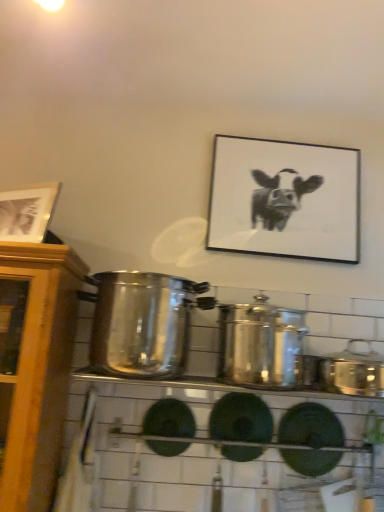
This screenshot has height=512, width=384. Describe the element at coordinates (27, 212) in the screenshot. I see `wooden picture frame at upper left, which is counted as the second picture frame, starting from the back` at that location.

Describe the element at coordinates (284, 199) in the screenshot. The height and width of the screenshot is (512, 384). I see `black matte picture frame at upper center, positioned as the 1th picture frame in right-to-left order` at that location.

Where is `satin silver crock pot at right, the first crock pot in the right-to-left sequence`? satin silver crock pot at right, the first crock pot in the right-to-left sequence is located at coordinates (355, 371).

From a real-world perspective, who is located higher, satin silver pot at center, placed as the first crock pot when sorted from left to right, or shiny metallic crock pot at center, acting as the 2th crock pot starting from the left?

satin silver pot at center, placed as the first crock pot when sorted from left to right.

Is satin silver pot at center, placed as the first crock pot when sorted from left to right, not close to shiny metallic crock pot at center, the second crock pot when ordered from right to left?

satin silver pot at center, placed as the first crock pot when sorted from left to right, is near shiny metallic crock pot at center, the second crock pot when ordered from right to left, not far away.

From the picture: Which is more to the left, satin silver pot at center, which is the third crock pot from right to left, or shiny metallic crock pot at center, the second crock pot when ordered from right to left?

Positioned to the left is satin silver pot at center, which is the third crock pot from right to left.

Can you confirm if satin silver pot at center, which is the third crock pot from right to left, is taller than shiny metallic crock pot at center, the second crock pot when ordered from right to left?

Yes, satin silver pot at center, which is the third crock pot from right to left, is taller than shiny metallic crock pot at center, the second crock pot when ordered from right to left.

Would you say shiny metallic crock pot at center, the second crock pot when ordered from right to left, is inside or outside satin silver pot at center, placed as the first crock pot when sorted from left to right?

shiny metallic crock pot at center, the second crock pot when ordered from right to left, is spatially situated outside satin silver pot at center, placed as the first crock pot when sorted from left to right.

From the image's perspective, does shiny metallic crock pot at center, the second crock pot when ordered from right to left, appear higher than satin silver pot at center, which is the third crock pot from right to left?

No, from the image's perspective, shiny metallic crock pot at center, the second crock pot when ordered from right to left, is not above satin silver pot at center, which is the third crock pot from right to left.

Between shiny metallic crock pot at center, acting as the 2th crock pot starting from the left, and satin silver pot at center, which is the third crock pot from right to left, which one appears on the right side from the viewer's perspective?

From the viewer's perspective, shiny metallic crock pot at center, acting as the 2th crock pot starting from the left, appears more on the right side.

Which of these two, shiny metallic crock pot at center, the second crock pot when ordered from right to left, or satin silver pot at center, placed as the first crock pot when sorted from left to right, stands taller?

satin silver pot at center, placed as the first crock pot when sorted from left to right, is taller.

This screenshot has height=512, width=384. Identify the location of the 2nd crock pot to the right when counting from the satin silver pot at center, placed as the first crock pot when sorted from left to right. (355, 371).

From the image's perspective, which is below, satin silver crock pot at right, the third crock pot in the left-to-right sequence, or satin silver pot at center, placed as the first crock pot when sorted from left to right?

satin silver crock pot at right, the third crock pot in the left-to-right sequence, is shown below in the image.

From the picture: Considering the positions of objects satin silver crock pot at right, the first crock pot in the right-to-left sequence, and satin silver pot at center, placed as the first crock pot when sorted from left to right, in the image provided, who is more to the right, satin silver crock pot at right, the first crock pot in the right-to-left sequence, or satin silver pot at center, placed as the first crock pot when sorted from left to right,?

satin silver crock pot at right, the first crock pot in the right-to-left sequence, is more to the right.

Considering the relative sizes of satin silver crock pot at right, the third crock pot in the left-to-right sequence, and satin silver pot at center, placed as the first crock pot when sorted from left to right, in the image provided, is satin silver crock pot at right, the third crock pot in the left-to-right sequence, smaller than satin silver pot at center, placed as the first crock pot when sorted from left to right,?

Yes, satin silver crock pot at right, the third crock pot in the left-to-right sequence, is smaller than satin silver pot at center, placed as the first crock pot when sorted from left to right.

From a real-world perspective, who is located higher, black matte picture frame at upper center, the second picture frame when ordered from left to right, or satin silver pot at center, which is the third crock pot from right to left?

In real-world perspective, black matte picture frame at upper center, the second picture frame when ordered from left to right, is above.

Between black matte picture frame at upper center, the second picture frame when ordered from left to right, and satin silver pot at center, placed as the first crock pot when sorted from left to right, which one has more height?

black matte picture frame at upper center, the second picture frame when ordered from left to right, is taller.

Considering the positions of point (326, 185) and point (159, 375), is point (326, 185) closer or farther from the camera than point (159, 375)?

Point (326, 185) is farther from the camera than point (159, 375).

Locate an element on the screen. the 2nd crock pot located beneath the wooden picture frame at upper left, the 1th picture frame from the left (from a real-world perspective) is located at coordinates (259, 343).

From a real-world perspective, is shiny metallic crock pot at center, acting as the 2th crock pot starting from the left, above or below wooden picture frame at upper left, the 1th picture frame from the left?

In terms of real-world spatial position, shiny metallic crock pot at center, acting as the 2th crock pot starting from the left, is below wooden picture frame at upper left, the 1th picture frame from the left.

Is shiny metallic crock pot at center, acting as the 2th crock pot starting from the left, oriented towards wooden picture frame at upper left, the second picture frame when ordered from right to left?

No, shiny metallic crock pot at center, acting as the 2th crock pot starting from the left, does not turn towards wooden picture frame at upper left, the second picture frame when ordered from right to left.

Looking at this image, does wooden picture frame at upper left, which is the 1th picture frame in front-to-back order, contain shiny metallic crock pot at center, acting as the 2th crock pot starting from the left?

Actually, shiny metallic crock pot at center, acting as the 2th crock pot starting from the left, is outside wooden picture frame at upper left, which is the 1th picture frame in front-to-back order.

Looking at this image, based on their positions, is wooden picture frame at upper left, the 1th picture frame from the left, located to the left or right of shiny metallic crock pot at center, the second crock pot when ordered from right to left?

In the image, wooden picture frame at upper left, the 1th picture frame from the left, appears on the left side of shiny metallic crock pot at center, the second crock pot when ordered from right to left.

In the image, is wooden picture frame at upper left, which is the 1th picture frame in front-to-back order, positioned in front of or behind shiny metallic crock pot at center, the second crock pot when ordered from right to left?

Visually, wooden picture frame at upper left, which is the 1th picture frame in front-to-back order, is located behind shiny metallic crock pot at center, the second crock pot when ordered from right to left.

Between satin silver crock pot at right, the first crock pot in the right-to-left sequence, and wooden picture frame at upper left, the 1th picture frame from the left, which one has larger size?

With larger size is satin silver crock pot at right, the first crock pot in the right-to-left sequence.

Measure the distance from satin silver crock pot at right, the first crock pot in the right-to-left sequence, to wooden picture frame at upper left, which is counted as the second picture frame, starting from the back.

satin silver crock pot at right, the first crock pot in the right-to-left sequence, and wooden picture frame at upper left, which is counted as the second picture frame, starting from the back, are 37.33 inches apart from each other.

From the image's perspective, is satin silver crock pot at right, the first crock pot in the right-to-left sequence, located above or below wooden picture frame at upper left, which is counted as the second picture frame, starting from the back?

satin silver crock pot at right, the first crock pot in the right-to-left sequence, is below wooden picture frame at upper left, which is counted as the second picture frame, starting from the back.

Locate an element on the screen. crock pot above the shiny metallic crock pot at center, the second crock pot when ordered from right to left (from a real-world perspective) is located at coordinates (142, 322).

Where is `the 1st crock pot behind the shiny metallic crock pot at center, the second crock pot when ordered from right to left, counting from the anchor's position`? the 1st crock pot behind the shiny metallic crock pot at center, the second crock pot when ordered from right to left, counting from the anchor's position is located at coordinates (142, 322).

From the image, which object appears to be farther from shiny metallic crock pot at center, acting as the 2th crock pot starting from the left, satin silver crock pot at right, the third crock pot in the left-to-right sequence, or black matte picture frame at upper center, the second picture frame when ordered from left to right?

black matte picture frame at upper center, the second picture frame when ordered from left to right.

Which object lies further to the anchor point black matte picture frame at upper center, arranged as the first picture frame when viewed from the back, satin silver crock pot at right, the third crock pot in the left-to-right sequence, or shiny metallic crock pot at center, acting as the 2th crock pot starting from the left?

Among the two, satin silver crock pot at right, the third crock pot in the left-to-right sequence, is located further to black matte picture frame at upper center, arranged as the first picture frame when viewed from the back.

Estimate the real-world distances between objects in this image. Which object is closer to satin silver pot at center, which is the third crock pot from right to left, satin silver crock pot at right, the third crock pot in the left-to-right sequence, or black matte picture frame at upper center, positioned as the 1th picture frame in right-to-left order?

Among the two, black matte picture frame at upper center, positioned as the 1th picture frame in right-to-left order, is located nearer to satin silver pot at center, which is the third crock pot from right to left.

Considering their positions, is black matte picture frame at upper center, arranged as the first picture frame when viewed from the back, positioned further to shiny metallic crock pot at center, the second crock pot when ordered from right to left, than wooden picture frame at upper left, which is counted as the second picture frame, starting from the back?

The object further to shiny metallic crock pot at center, the second crock pot when ordered from right to left, is wooden picture frame at upper left, which is counted as the second picture frame, starting from the back.

Consider the image. Based on their spatial positions, is satin silver pot at center, which is the third crock pot from right to left, or shiny metallic crock pot at center, the second crock pot when ordered from right to left, further from wooden picture frame at upper left, which is the 1th picture frame in front-to-back order?

shiny metallic crock pot at center, the second crock pot when ordered from right to left.

Looking at the image, which one is located further to satin silver crock pot at right, the third crock pot in the left-to-right sequence, black matte picture frame at upper center, positioned as the 1th picture frame in right-to-left order, or satin silver pot at center, placed as the first crock pot when sorted from left to right?

satin silver pot at center, placed as the first crock pot when sorted from left to right.

Considering their positions, is satin silver pot at center, placed as the first crock pot when sorted from left to right, positioned further to black matte picture frame at upper center, arranged as the first picture frame when viewed from the back, than satin silver crock pot at right, the third crock pot in the left-to-right sequence?

satin silver crock pot at right, the third crock pot in the left-to-right sequence.

When comparing their distances from satin silver pot at center, placed as the first crock pot when sorted from left to right, does wooden picture frame at upper left, the 1th picture frame from the left, or satin silver crock pot at right, the first crock pot in the right-to-left sequence, seem further?

The object further to satin silver pot at center, placed as the first crock pot when sorted from left to right, is satin silver crock pot at right, the first crock pot in the right-to-left sequence.

Locate an element on the screen. This screenshot has width=384, height=512. picture frame between satin silver pot at center, which is the third crock pot from right to left, and satin silver crock pot at right, the third crock pot in the left-to-right sequence, from left to right is located at coordinates [x=284, y=199].

The width and height of the screenshot is (384, 512). In order to click on picture frame between wooden picture frame at upper left, which is the 1th picture frame in front-to-back order, and satin silver crock pot at right, the third crock pot in the left-to-right sequence in this screenshot , I will do `click(284, 199)`.

Identify the location of crock pot situated between satin silver pot at center, placed as the first crock pot when sorted from left to right, and black matte picture frame at upper center, positioned as the 1th picture frame in right-to-left order, from left to right. Image resolution: width=384 pixels, height=512 pixels. (259, 343).

Image resolution: width=384 pixels, height=512 pixels. What are the coordinates of `crock pot between satin silver pot at center, which is the third crock pot from right to left, and satin silver crock pot at right, the first crock pot in the right-to-left sequence` in the screenshot? It's located at (259, 343).